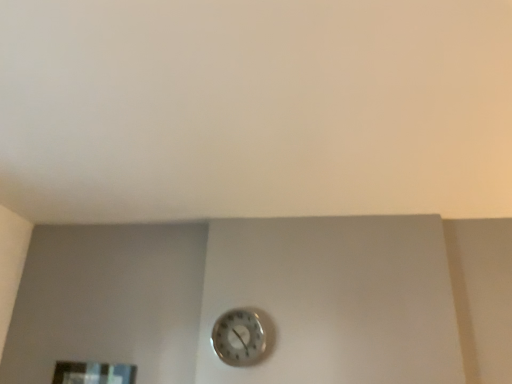
Question: Should I look upward or downward to see metallic silver wall clock at center?

Choices:
 (A) up
 (B) down

Answer: (B)